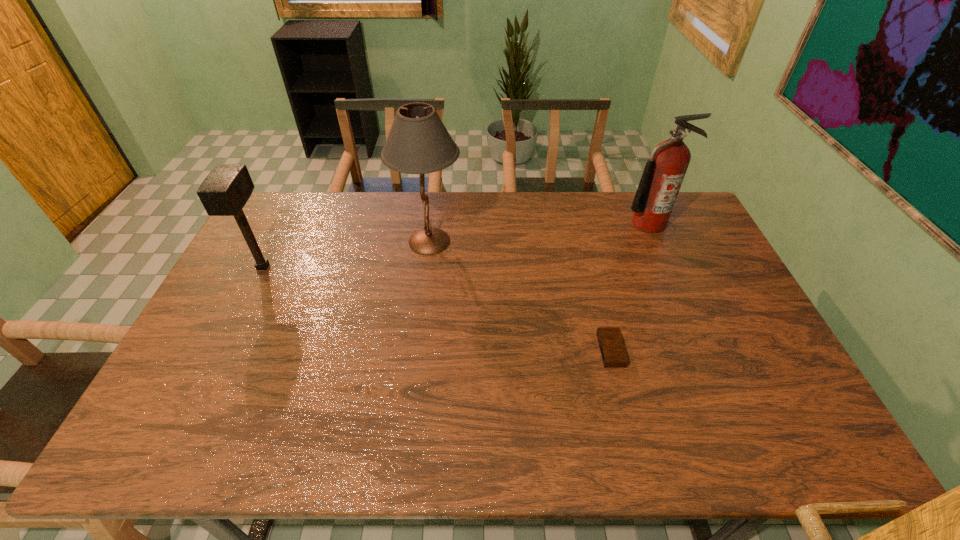
Locate an element on the screen. The width and height of the screenshot is (960, 540). vacant space located 0.130m on the front face of the alarm clock is located at coordinates (552, 350).

Identify the location of vacant region located 0.360m on the front face of the alarm clock. The height and width of the screenshot is (540, 960). (467, 350).

Identify the location of table lamp that is at the far edge. The width and height of the screenshot is (960, 540). (418, 143).

Where is `fire extinguisher that is positioned at the far edge`? fire extinguisher that is positioned at the far edge is located at coordinates (664, 172).

Find the location of a particular element. The width and height of the screenshot is (960, 540). object present at the left edge is located at coordinates (224, 192).

At what (x,y) coordinates should I click in order to perform the action: click on object that is positioned at the right edge. Please return your answer as a coordinate pair (x, y). This screenshot has width=960, height=540. Looking at the image, I should click on (664, 172).

Where is `object at the far right corner`? This screenshot has width=960, height=540. object at the far right corner is located at coordinates (664, 172).

In order to click on free space at the far edge of the desktop in this screenshot , I will do `click(614, 231)`.

You are a GUI agent. You are given a task and a screenshot of the screen. Output one action in this format:
    pyautogui.click(x=<x>, y=<y>)
    Task: Click on the free space at the left edge of the desktop
    The height and width of the screenshot is (540, 960).
    Given the screenshot: What is the action you would take?
    pyautogui.click(x=216, y=326)

The height and width of the screenshot is (540, 960). In the image, there is a desktop. What are the coordinates of `vacant space at the right edge` in the screenshot? It's located at (774, 372).